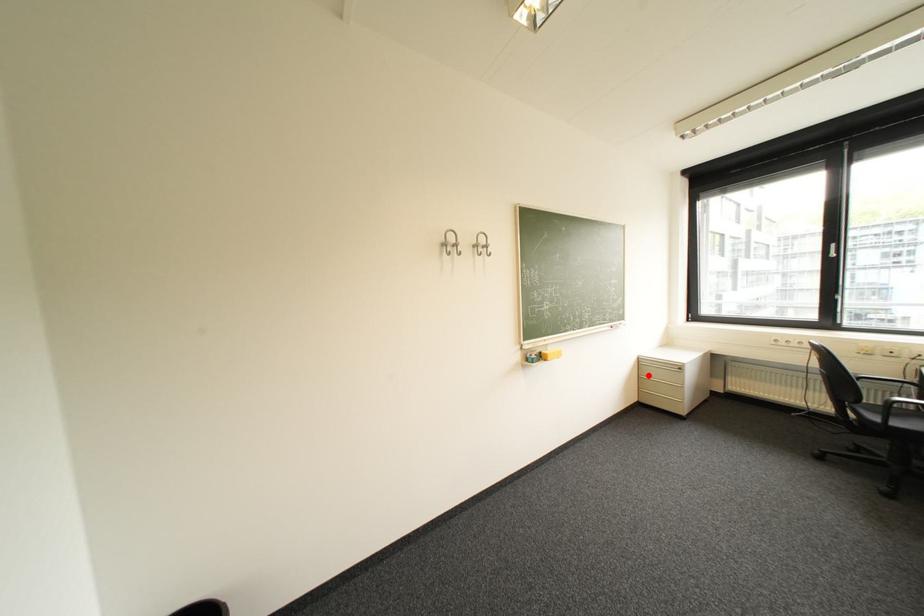
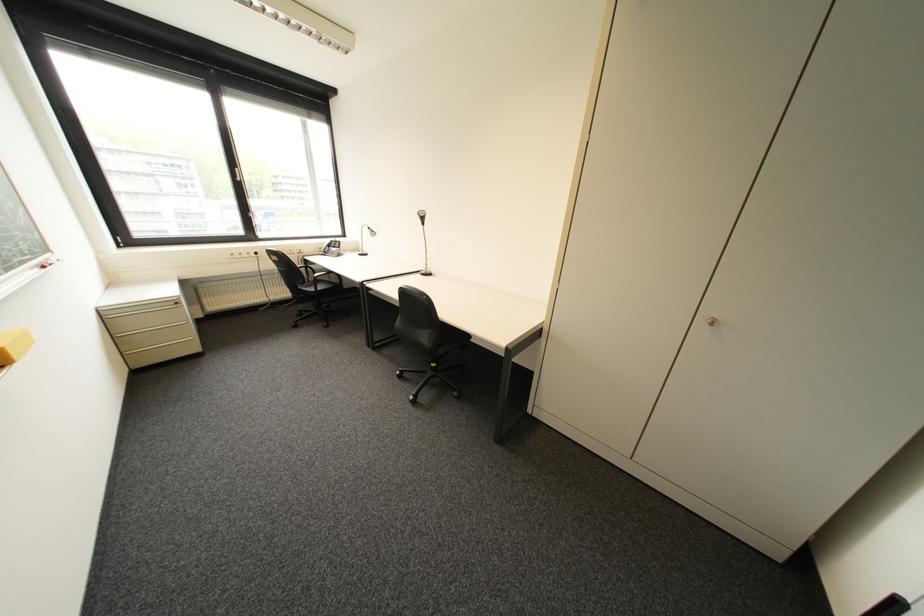
In the second image, find the point that corresponds to the highlighted location in the first image.

(122, 336)